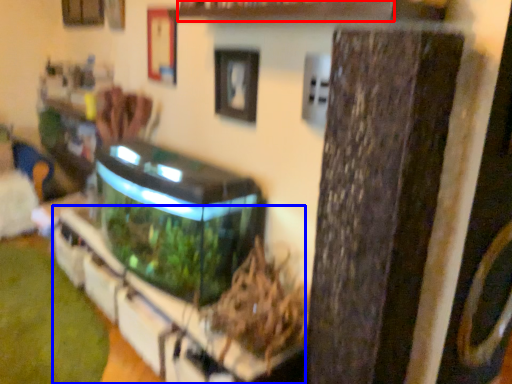
Question: Which object is closer to the camera taking this photo, shelf (highlighted by a red box) or shelf (highlighted by a blue box)?

Choices:
 (A) shelf
 (B) shelf

Answer: (A)